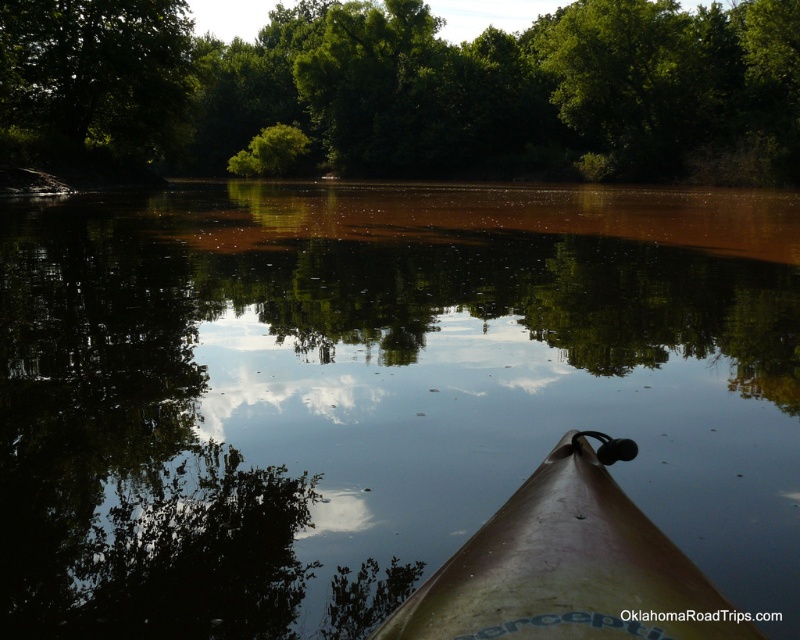
Question: Is smooth brown water at center wider than green leafy tree at upper center?

Choices:
 (A) no
 (B) yes

Answer: (A)

Question: Estimate the real-world distances between objects in this image. Which object is closer to the smooth brown water at center?

Choices:
 (A) green leafy tree at upper left
 (B) green leafy tree at upper center

Answer: (A)

Question: Does smooth brown water at center appear under green leafy tree at upper center?

Choices:
 (A) no
 (B) yes

Answer: (B)

Question: Which of the following is the farthest from the observer?

Choices:
 (A) (132, 12)
 (B) (548, 538)

Answer: (A)

Question: Which object appears closest to the camera in this image?

Choices:
 (A) brown matte kayak at center
 (B) smooth brown water at center
 (C) green leafy tree at upper left

Answer: (A)

Question: Is smooth brown water at center thinner than green leafy tree at upper center?

Choices:
 (A) no
 (B) yes

Answer: (B)